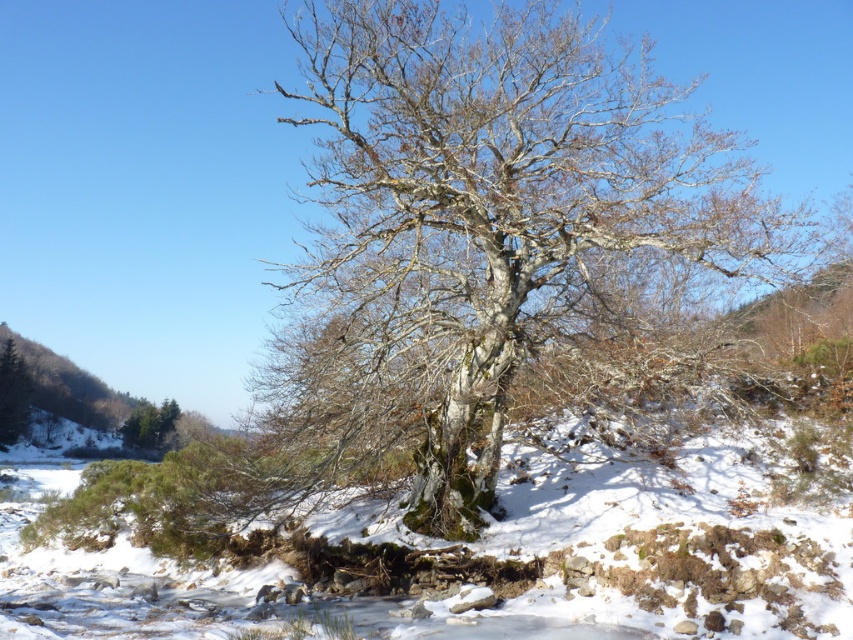
You are a bird flying over the winter landscape shown in the image. You want to land on the gray bark tree at center. Based on its 2D location, where should you aim to land?

The gray bark tree at center is located at the 2D coordinates point (474,228), so you should aim for that point to land on it.

You are planning to build a snowman using the white powdery snow at center and the green matte tree at lower left as landmarks. Which area has enough material to form a base for the snowman?

The white powdery snow at center has a larger width than the green matte tree at lower left, so it has enough material to form a base for the snowman.